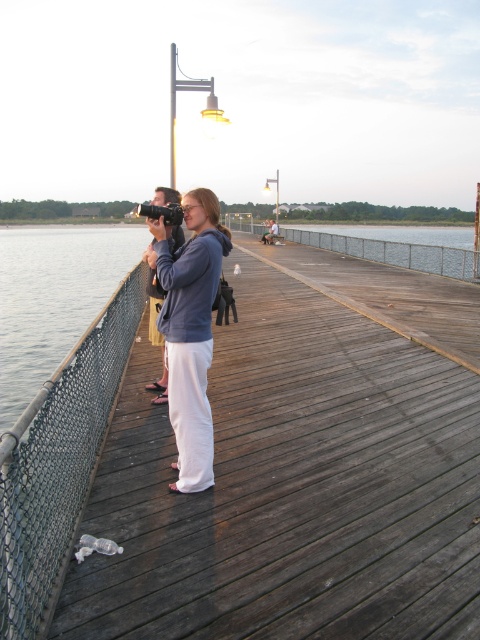
Question: Is dark wood dock at center to the right of matte gray hoodie at center from the viewer's perspective?

Choices:
 (A) no
 (B) yes

Answer: (B)

Question: Which object appears closest to the camera in this image?

Choices:
 (A) dark wood dock at center
 (B) matte gray hoodie at center

Answer: (A)

Question: Which point appears farthest from the camera in this image?

Choices:
 (A) (48, 570)
 (B) (220, 241)

Answer: (B)

Question: Where is dark wood dock at center located in relation to matte gray hoodie at center in the image?

Choices:
 (A) above
 (B) below

Answer: (A)

Question: Is dark wood dock at center further to camera compared to matte gray hoodie at center?

Choices:
 (A) yes
 (B) no

Answer: (B)